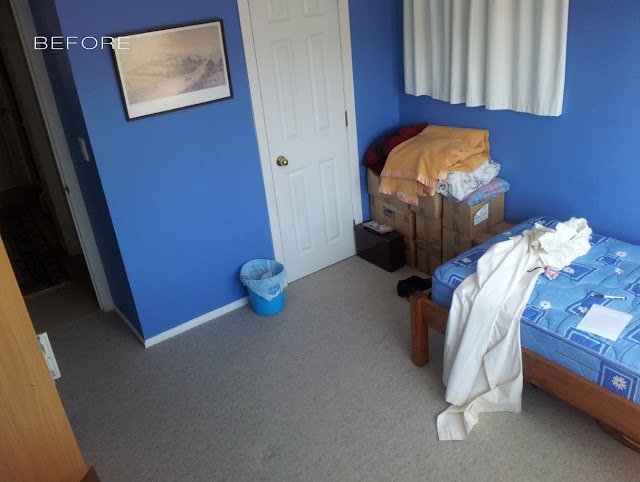
Where is `book`? book is located at coordinates (34, 412), (54, 366).